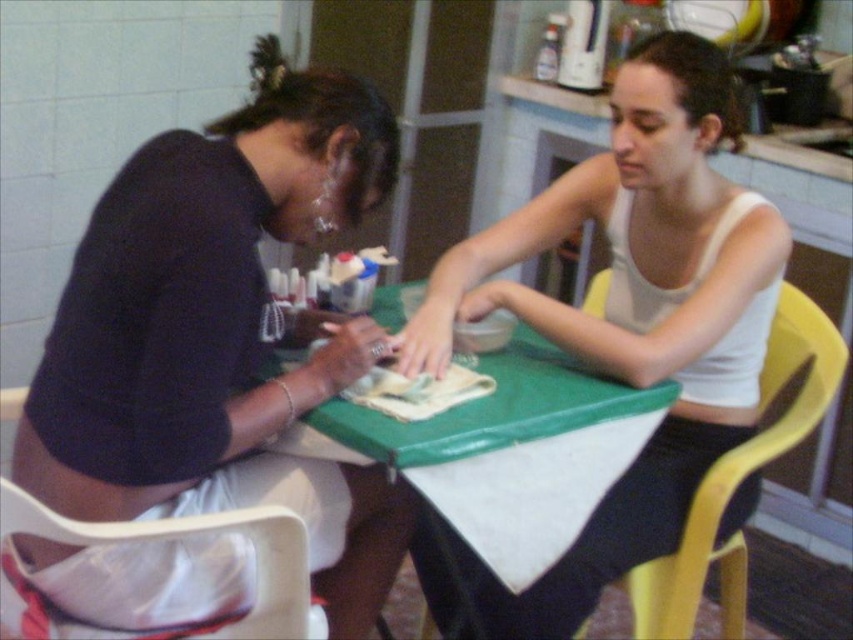
From the picture: Can you confirm if white matte tank top at center is positioned to the left of plastic bag at lower left?

Incorrect, white matte tank top at center is not on the left side of plastic bag at lower left.

Does white matte tank top at center appear on the right side of plastic bag at lower left?

Correct, you'll find white matte tank top at center to the right of plastic bag at lower left.

Locate an element on the screen. The width and height of the screenshot is (853, 640). white matte tank top at center is located at coordinates (622, 326).

Does white matte tank top at center have a lesser width compared to green plastic table at center?

In fact, white matte tank top at center might be wider than green plastic table at center.

Is point (735, 413) farther from camera compared to point (372, 420)?

Yes, it is.

The image size is (853, 640). I want to click on white matte tank top at center, so click(622, 326).

Who is more distant from viewer, [428,637] or [277,568]?

Point [428,637]

How far apart are yellow plastic chair at right and plastic bag at lower left?

They are 30.82 inches apart.

Between point (769, 374) and point (260, 548), which one is positioned behind?

Positioned behind is point (769, 374).

The image size is (853, 640). I want to click on yellow plastic chair at right, so click(740, 480).